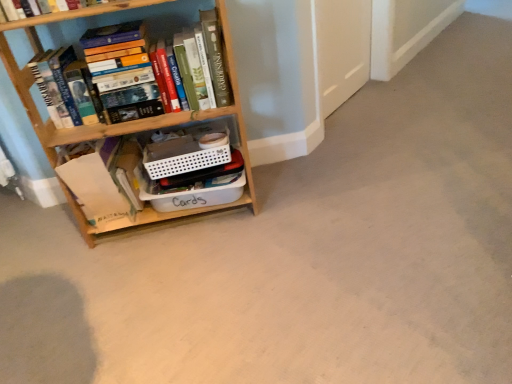
Question: Is white paper bag at lower left, the 1th book in the bottom-to-top sequence, wider or thinner than wooden bookcase at left?

Choices:
 (A) wide
 (B) thin

Answer: (B)

Question: Is white paper bag at lower left, the second book when ordered from top to bottom, situated inside wooden bookcase at left or outside?

Choices:
 (A) inside
 (B) outside

Answer: (A)

Question: Which is farther from the wooden bookcase at left?

Choices:
 (A) white paper bag at lower left, the 1th book in the bottom-to-top sequence
 (B) hardcover books at left, which appears as the 1th book when viewed from the top
 (C) white plastic container at center

Answer: (B)

Question: Which is nearer to the wooden bookcase at left?

Choices:
 (A) white paper bag at lower left, the second book when ordered from top to bottom
 (B) hardcover books at left, which appears as the 1th book when viewed from the top
 (C) white plastic container at center

Answer: (C)